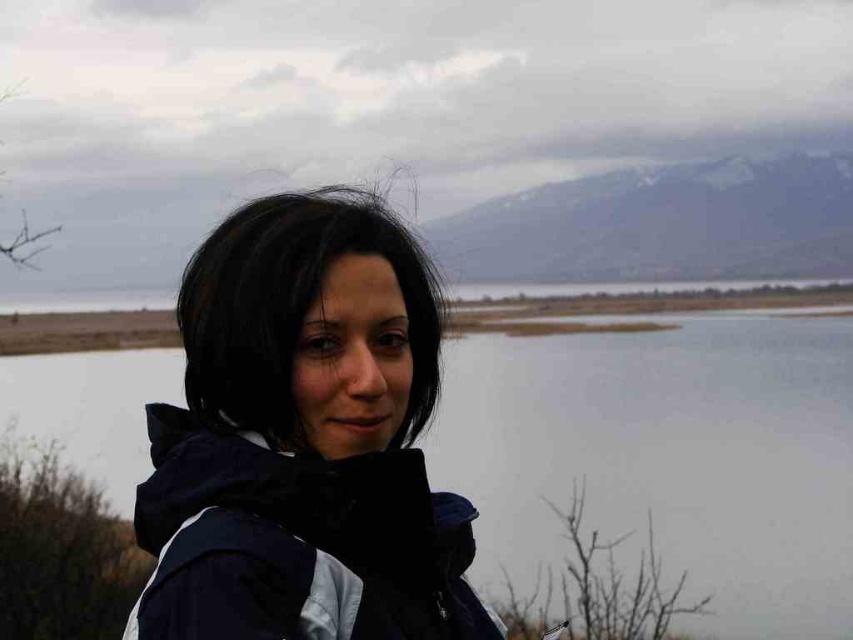
You are a photographer trying to capture the person in the scene. Since the matte black jacket at center and the black matte hair at center are both dark in color, which one should you adjust your camera focus to ensure the subject stands out against the background?

The matte black jacket at center is to the right of black matte hair at center. To ensure the subject stands out, focus on the matte black jacket at center since it is positioned to the right, which might be a better focal point given its placement relative to the person and the background.

You are a photographer trying to capture a portrait of the person in the scene. Given that the matte black jacket at center and the black matte hair at center are both in the frame, which object would appear larger in the photo?

The matte black jacket at center would appear larger in the photo because it is much taller than the black matte hair at center.